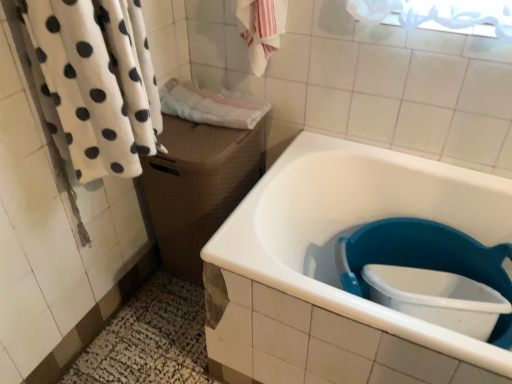
Question: Is brown woven box at center wider than white fluffy towel at left, arranged as the 3th bath towel when viewed from the back?

Choices:
 (A) yes
 (B) no

Answer: (A)

Question: From a real-world perspective, is brown woven box at center on white fluffy towel at left, which appears as the 1th bath towel when viewed from the front?

Choices:
 (A) no
 (B) yes

Answer: (A)

Question: Is brown woven box at center facing away from white fluffy towel at left, arranged as the 3th bath towel when viewed from the back?

Choices:
 (A) no
 (B) yes

Answer: (A)

Question: Is white fluffy towel at left, arranged as the 3th bath towel when viewed from the back, surrounded by brown woven box at center?

Choices:
 (A) yes
 (B) no

Answer: (B)

Question: Is brown woven box at center to the right of white fluffy towel at left, which appears as the 1th bath towel when viewed from the front, from the viewer's perspective?

Choices:
 (A) yes
 (B) no

Answer: (A)

Question: Can you confirm if brown woven box at center is smaller than white fluffy towel at left, arranged as the 3th bath towel when viewed from the back?

Choices:
 (A) yes
 (B) no

Answer: (B)

Question: Does brown woven box at center have a smaller size compared to pink terry cloth towel at center, the third bath towel in the front-to-back sequence?

Choices:
 (A) no
 (B) yes

Answer: (A)

Question: Can you confirm if brown woven box at center is shorter than pink terry cloth towel at center, marked as the first bath towel in a back-to-front arrangement?

Choices:
 (A) no
 (B) yes

Answer: (A)

Question: Can you confirm if brown woven box at center is bigger than pink terry cloth towel at center, marked as the first bath towel in a back-to-front arrangement?

Choices:
 (A) no
 (B) yes

Answer: (B)

Question: Is brown woven box at center turned away from pink terry cloth towel at center, marked as the first bath towel in a back-to-front arrangement?

Choices:
 (A) yes
 (B) no

Answer: (B)

Question: Is brown woven box at center at the left side of pink terry cloth towel at center, the third bath towel in the front-to-back sequence?

Choices:
 (A) yes
 (B) no

Answer: (A)

Question: Can you confirm if brown woven box at center is thinner than pink terry cloth towel at center, marked as the first bath towel in a back-to-front arrangement?

Choices:
 (A) no
 (B) yes

Answer: (A)

Question: From a real-world perspective, does white glossy bathtub at lower right stand above pink terry cloth towel at center, the third bath towel in the front-to-back sequence?

Choices:
 (A) no
 (B) yes

Answer: (A)